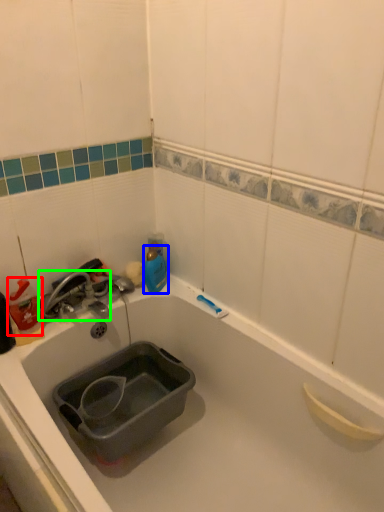
Question: Based on their relative distances, which object is nearer to cleaning product (highlighted by a red box)? Choose from bottle (highlighted by a blue box) and tap (highlighted by a green box).

Choices:
 (A) bottle
 (B) tap

Answer: (B)